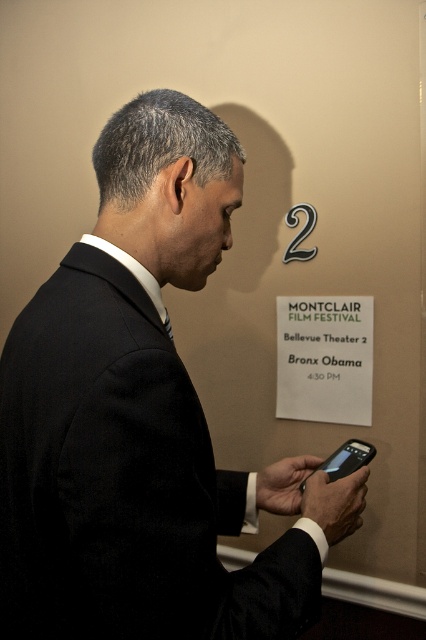
Who is positioned more to the left, black matte suit at center or white paper sign at upper center?

black matte suit at center

Does black matte suit at center lie in front of white paper sign at upper center?

Yes, black matte suit at center is in front of white paper sign at upper center.

Measure the distance between point (221, 632) and camera.

22.18 inches

Identify the location of black matte suit at center. This screenshot has height=640, width=426. (143, 420).